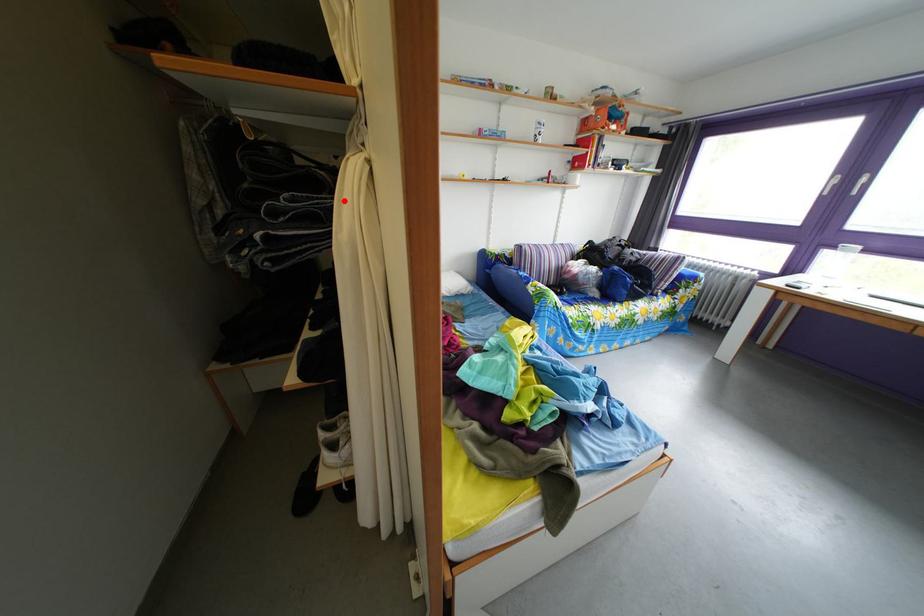
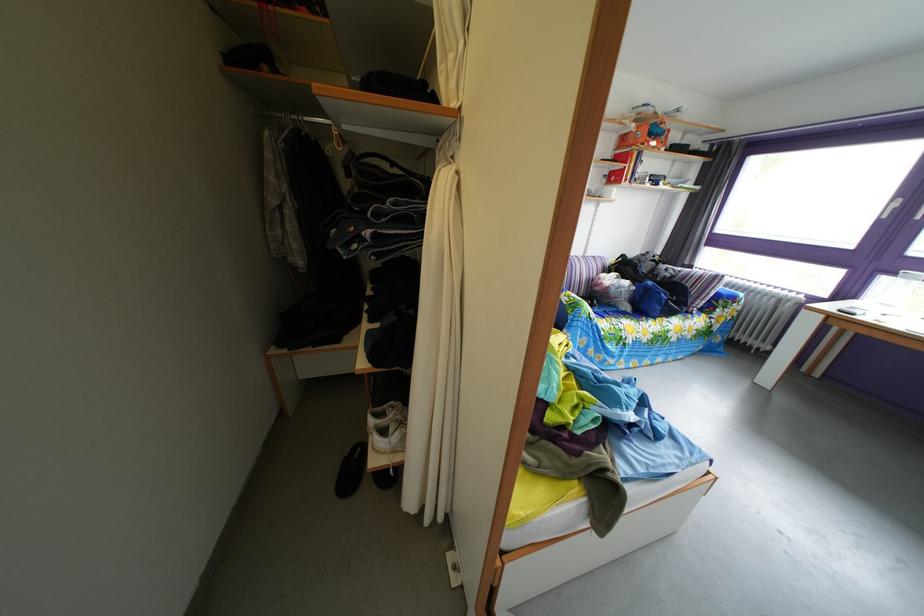
Locate, in the second image, the point that corresponds to the highlighted location in the first image.

(438, 207)